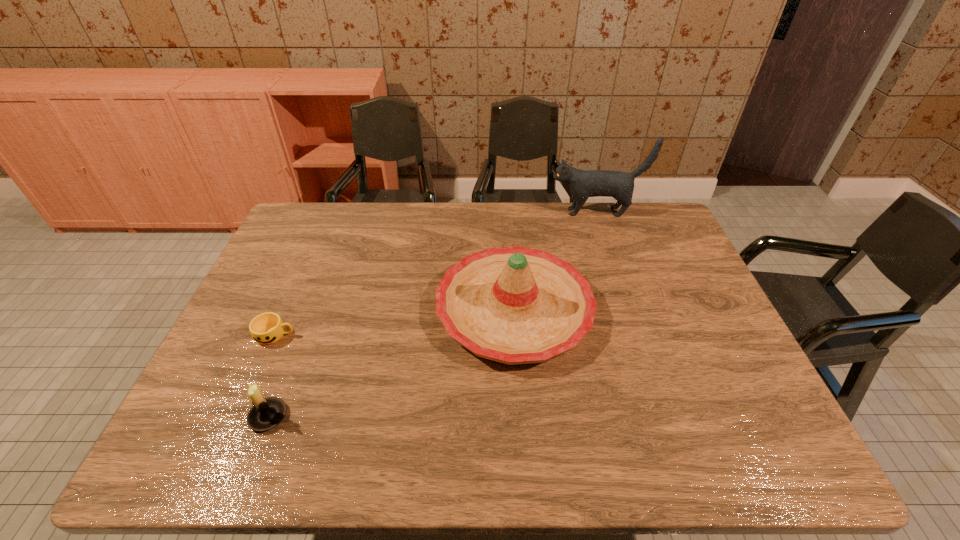
Identify the location of vacant space located on the right of the nearest object. Image resolution: width=960 pixels, height=540 pixels. (323, 416).

Where is `free space located 0.110m on the right of the cup`? The height and width of the screenshot is (540, 960). free space located 0.110m on the right of the cup is located at coordinates (337, 335).

Image resolution: width=960 pixels, height=540 pixels. Find the location of `object at the far edge`. object at the far edge is located at coordinates (582, 184).

Find the location of a particular element. object positioned at the near edge is located at coordinates (266, 413).

At what (x,y) coordinates should I click in order to perform the action: click on candle holder positioned at the left edge. Please return your answer as a coordinate pair (x, y). The image size is (960, 540). Looking at the image, I should click on (266, 413).

Where is `cup located at the left edge`? cup located at the left edge is located at coordinates (267, 328).

Find the location of `object situated at the right edge`. object situated at the right edge is located at coordinates pos(582,184).

Find the location of a particular element. The image size is (960, 540). object positioned at the near left corner is located at coordinates (266, 413).

At what (x,y) coordinates should I click in order to perform the action: click on object that is at the far right corner. Please return your answer as a coordinate pair (x, y). Looking at the image, I should click on (582, 184).

You are a GUI agent. You are given a task and a screenshot of the screen. Output one action in this format:
    pyautogui.click(x=<x>, y=<y>)
    Task: Click on the free space at the far edge
    
    Given the screenshot: What is the action you would take?
    pyautogui.click(x=346, y=240)